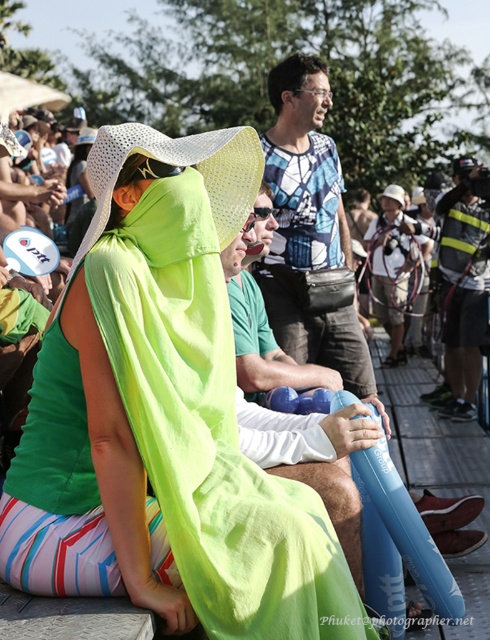
Question: Can you confirm if neon green towel at center is wider than neon green fabric robe at center?

Choices:
 (A) no
 (B) yes

Answer: (B)

Question: Does neon green towel at center appear over neon green fabric robe at center?

Choices:
 (A) no
 (B) yes

Answer: (A)

Question: Which point is closer to the camera taking this photo?

Choices:
 (A) (356, 384)
 (B) (240, 196)

Answer: (B)

Question: Does neon green towel at center appear on the right side of neon green fabric robe at center?

Choices:
 (A) yes
 (B) no

Answer: (B)